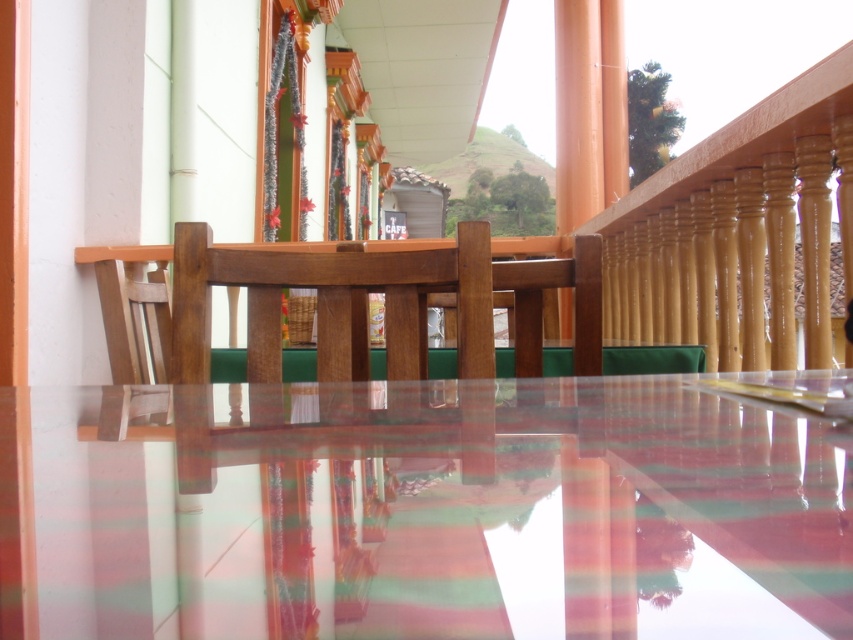
Is transparent glossy glass table at center smaller than wooden chair at center?

Yes, transparent glossy glass table at center is smaller than wooden chair at center.

Is point (534, 490) more distant than point (175, 307)?

No, it is not.

The width and height of the screenshot is (853, 640). I want to click on transparent glossy glass table at center, so click(422, 513).